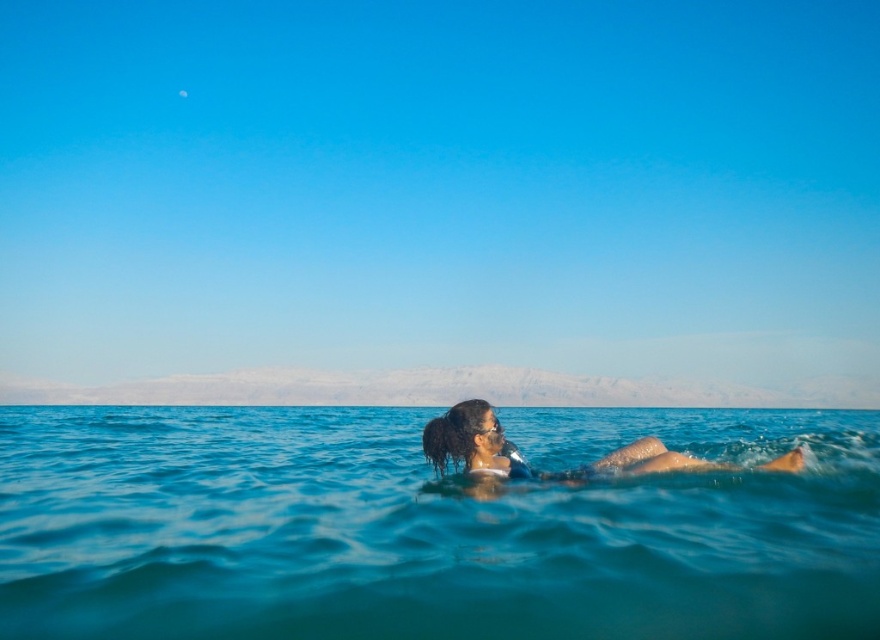
Which is more to the left, clear blue water at center or dark brown hair at center?

From the viewer's perspective, dark brown hair at center appears more on the left side.

Is point (317, 458) positioned after point (598, 464)?

Yes, it is.

Locate an element on the screen. The height and width of the screenshot is (640, 880). clear blue water at center is located at coordinates (428, 528).